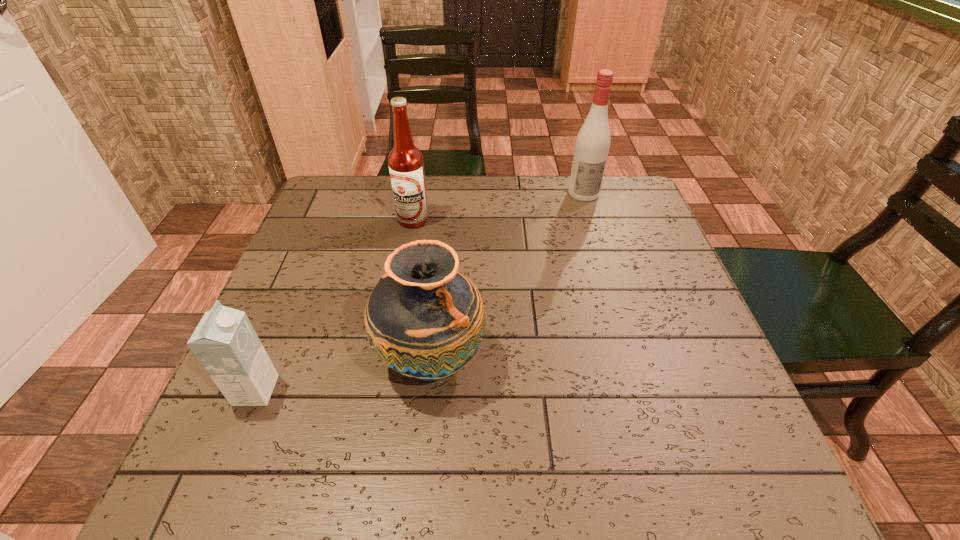
Where is `the farthest object`? The image size is (960, 540). the farthest object is located at coordinates click(593, 140).

The image size is (960, 540). I want to click on the farther alcohol, so click(593, 140).

Find the location of a particular element. Image resolution: width=960 pixels, height=540 pixels. the nearer alcohol is located at coordinates (406, 165).

At what (x,y) coordinates should I click in order to perform the action: click on the third nearest object. Please return your answer as a coordinate pair (x, y). This screenshot has height=540, width=960. Looking at the image, I should click on [x=406, y=165].

I want to click on pottery, so click(x=423, y=319).

The width and height of the screenshot is (960, 540). Find the location of `carton`. carton is located at coordinates (225, 343).

I want to click on the leftmost object, so click(225, 343).

The image size is (960, 540). Find the location of `vacant space positioned on the label of the rightmost object`. vacant space positioned on the label of the rightmost object is located at coordinates (612, 288).

The width and height of the screenshot is (960, 540). Find the location of `vacant space situated 0.340m on the label side of the second farthest object`. vacant space situated 0.340m on the label side of the second farthest object is located at coordinates (393, 334).

Image resolution: width=960 pixels, height=540 pixels. What are the coordinates of `free space located 0.240m on the back of the pottery` in the screenshot? It's located at (442, 244).